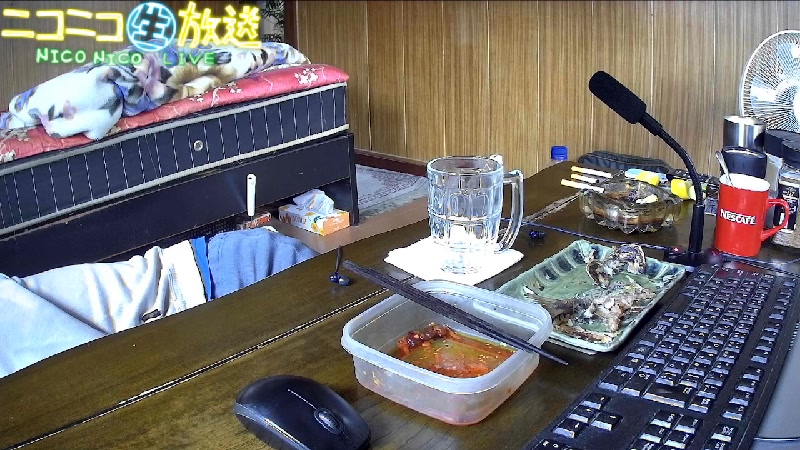
What are the coordinates of `cup` in the screenshot? It's located at (742, 221).